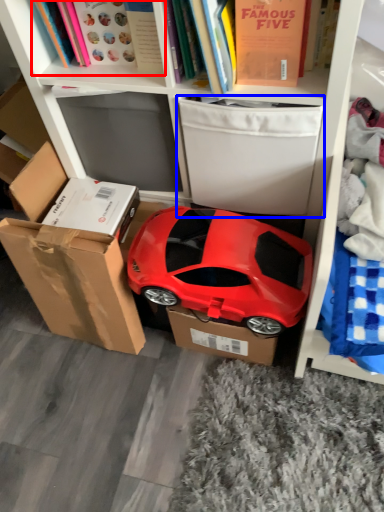
Question: Which object is further to the camera taking this photo, book (highlighted by a red box) or storage box (highlighted by a blue box)?

Choices:
 (A) book
 (B) storage box

Answer: (B)